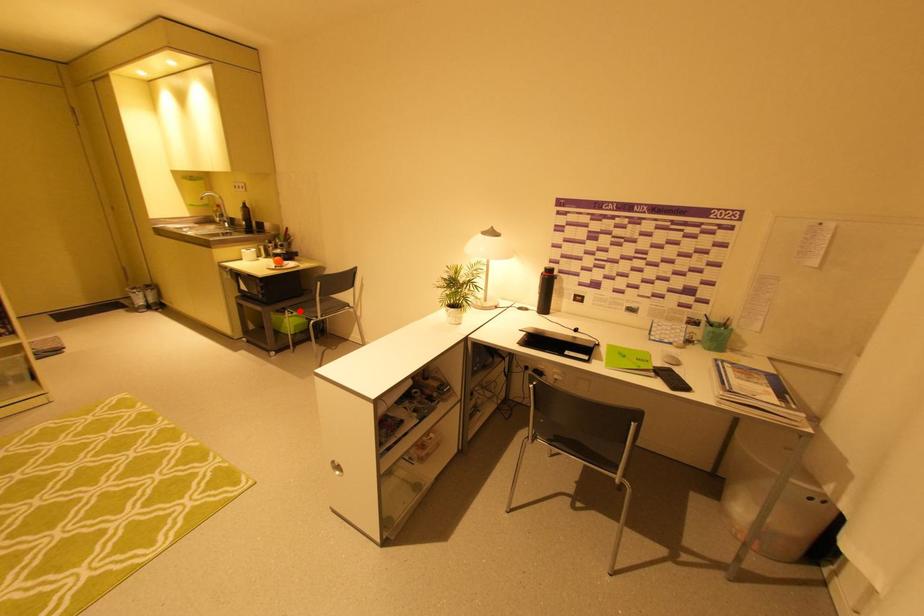
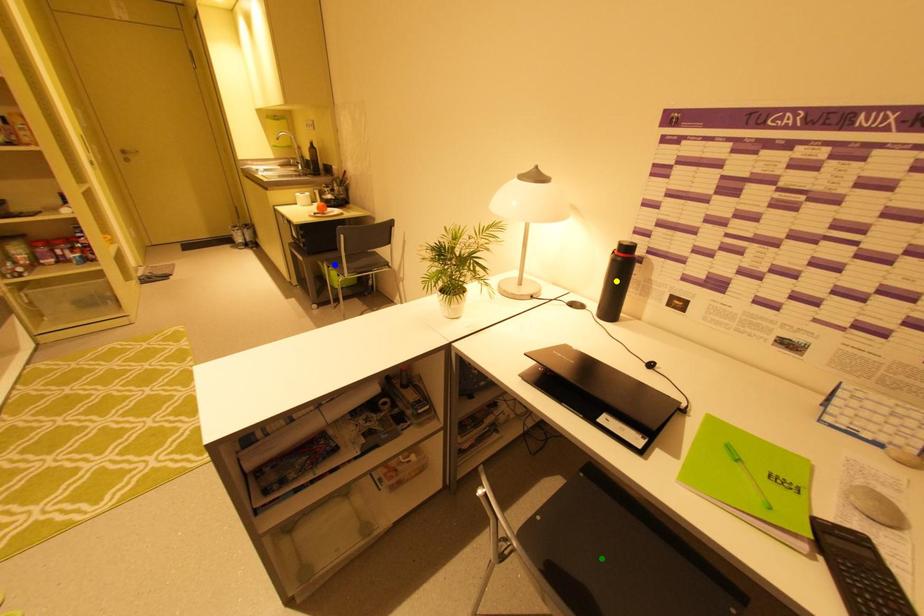
Question: I am providing you with two images of the same scene from different viewpoints. A red point is marked on the first image. You are given multiple points on the second image. In image 2, which mark is for the same physical point as the one in image 1?

Choices:
 (A) green point
 (B) yellow point
 (C) blue point

Answer: (C)